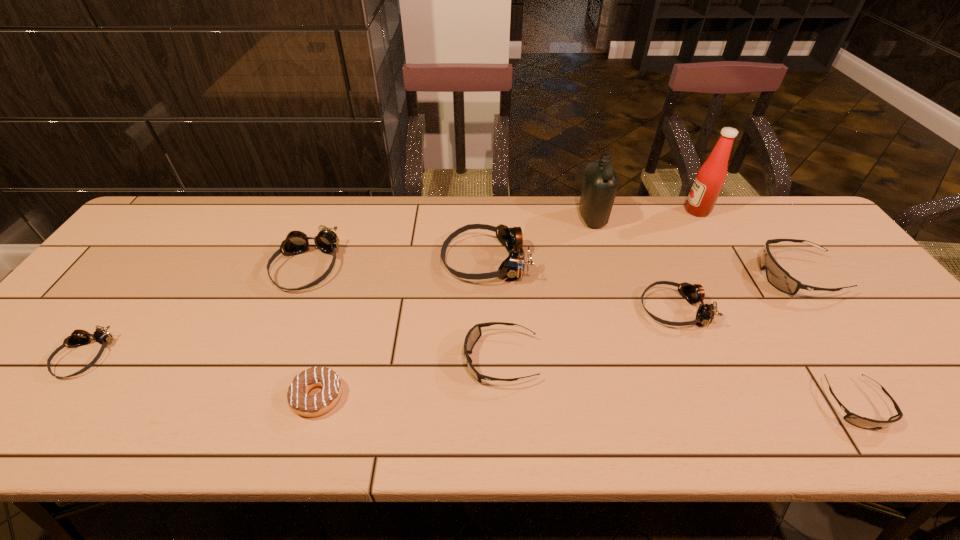
Where is `empty space between the red condiment and the second bronze goggles from right to left`? The width and height of the screenshot is (960, 540). empty space between the red condiment and the second bronze goggles from right to left is located at coordinates (591, 235).

Locate an element on the screen. This screenshot has width=960, height=540. free space between the fourth object from right to left and the farthest black goggles is located at coordinates (735, 293).

The width and height of the screenshot is (960, 540). Identify the location of free area in between the condiment and the bottle. (645, 214).

You are a GUI agent. You are given a task and a screenshot of the screen. Output one action in this format:
    pyautogui.click(x=<x>, y=<y>)
    Task: Click on the vacant area between the third bronze goggles from left to right and the tallest object
    The width and height of the screenshot is (960, 540).
    Given the screenshot: What is the action you would take?
    pyautogui.click(x=591, y=235)

Identify the location of free spot between the third goggles from right to left and the leftmost bronze goggles. (379, 333).

Where is `free point between the eighth shortest object and the sixth object from left to right`? The width and height of the screenshot is (960, 540). free point between the eighth shortest object and the sixth object from left to right is located at coordinates (539, 239).

Locate an element on the screen. vacant area between the ninth shortest object and the third tallest object is located at coordinates (539, 239).

Identify which object is the seventh closest to the third bronze goggles from right to left. Please provide its 2D coordinates. Your answer should be formatted as a tuple, i.e. [(x, y)], where the tuple contains the x and y coordinates of a point satisfying the conditions above.

[(710, 178)]

The image size is (960, 540). Find the location of `object that ranks as the third closest to the third bronze goggles from left to right`. object that ranks as the third closest to the third bronze goggles from left to right is located at coordinates (694, 293).

Find the location of a particular element. This screenshot has height=540, width=960. goggles that is the sixth closest to the second biggest bronze goggles is located at coordinates (862, 422).